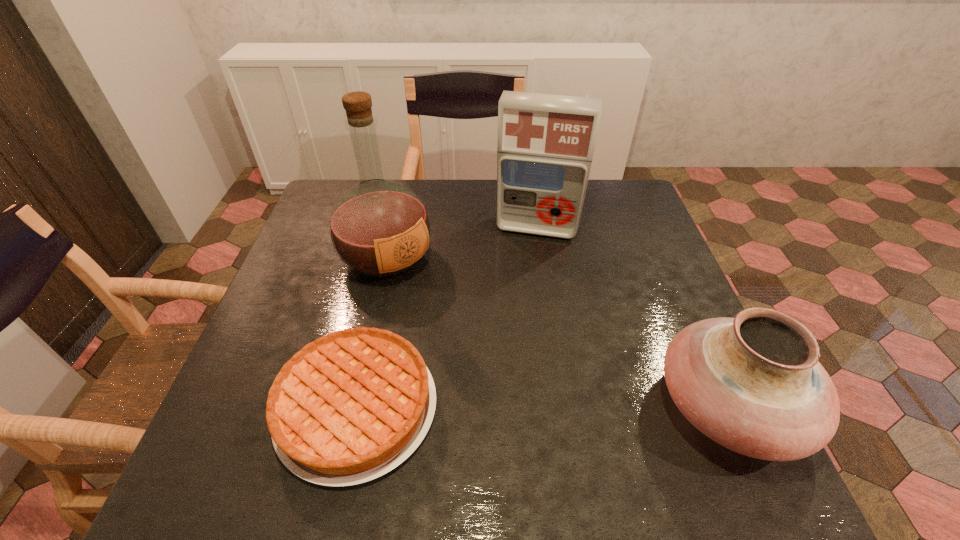
I want to click on vacant area that lies between the second object from right to left and the liquor, so click(462, 243).

Find the location of a particular element. The image size is (960, 540). free space between the shortest object and the first-aid kit is located at coordinates (447, 318).

Locate an element on the screen. vacant space that is in between the third shortest object and the liquor is located at coordinates (462, 243).

In order to click on free point between the second object from right to left and the liquor in this screenshot , I will do `click(462, 243)`.

Identify the location of vacant space that is in between the liquor and the third object from left to right. (462, 243).

This screenshot has width=960, height=540. Find the location of `free space between the liquor and the rightmost object`. free space between the liquor and the rightmost object is located at coordinates (558, 332).

Where is `vacant space that's between the rightmost object and the second object from right to left`? The width and height of the screenshot is (960, 540). vacant space that's between the rightmost object and the second object from right to left is located at coordinates tap(633, 318).

This screenshot has width=960, height=540. I want to click on free space between the pie and the first-aid kit, so click(447, 318).

This screenshot has height=540, width=960. I want to click on empty space that is in between the third object from left to right and the liquor, so click(x=462, y=243).

Identify which object is the second closest to the liquor. Please provide its 2D coordinates. Your answer should be formatted as a tuple, i.e. [(x, y)], where the tuple contains the x and y coordinates of a point satisfying the conditions above.

[(545, 145)]